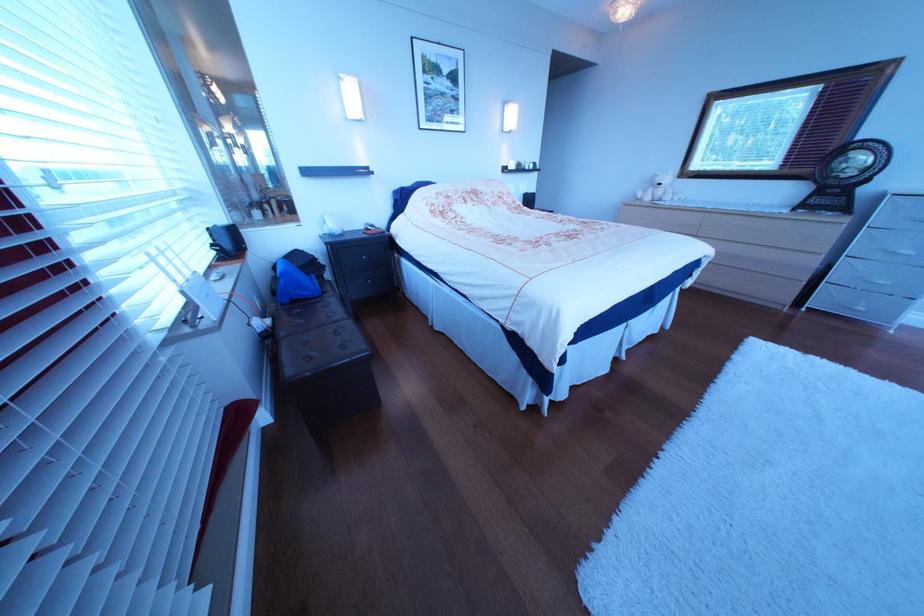
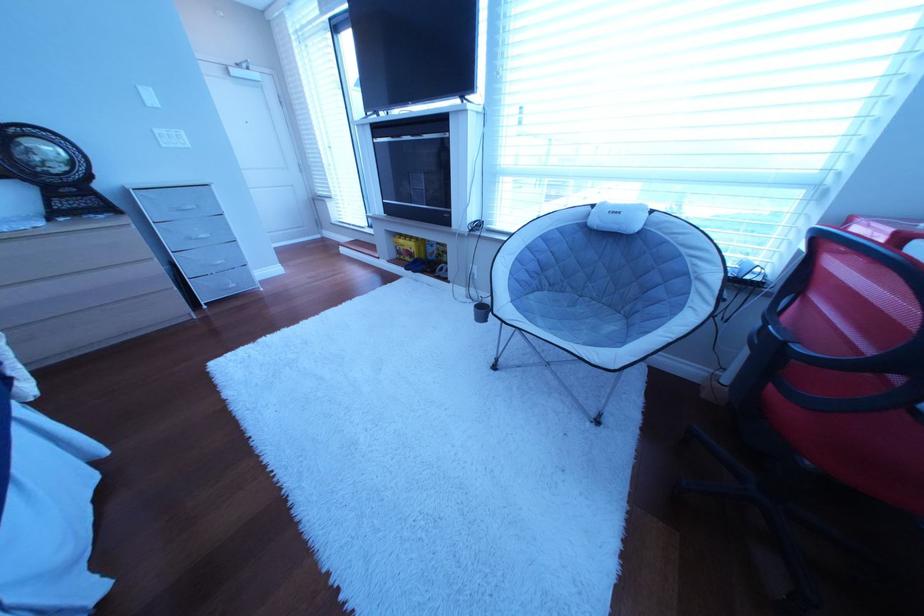
The images are taken continuously from a first-person perspective. In which direction is your viewpoint rotating?

The camera's rotation is toward right-down.